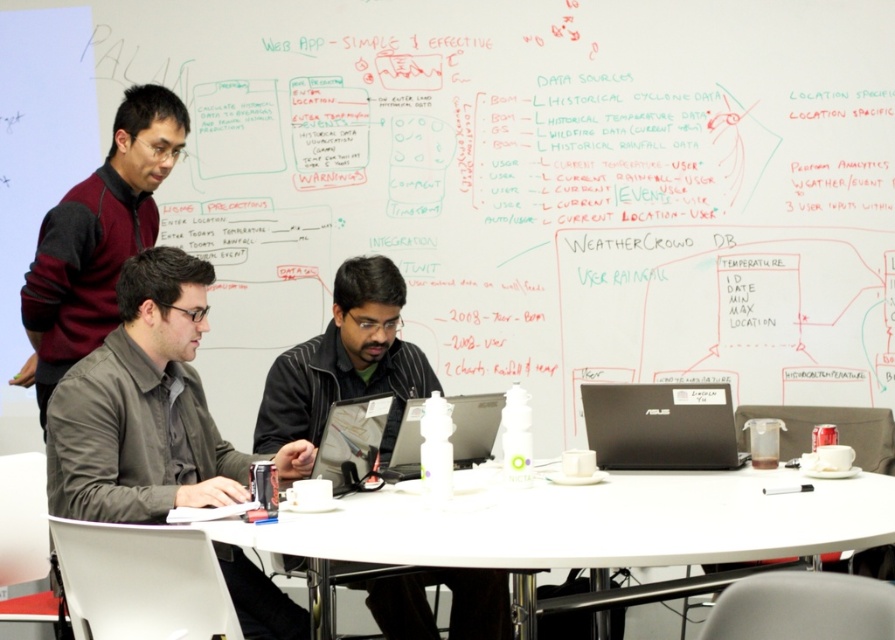
Which is below, whiteboard at upper center or dark gray shirt at center?

dark gray shirt at center

Consider the image. Does whiteboard at upper center appear on the left side of dark gray shirt at center?

In fact, whiteboard at upper center is to the right of dark gray shirt at center.

Where is `whiteboard at upper center`? whiteboard at upper center is located at coordinates (538, 186).

Does dark gray shirt at center have a lesser height compared to black matte laptop at center?

Incorrect, dark gray shirt at center's height does not fall short of black matte laptop at center's.

Does point (182, 465) come closer to viewer compared to point (594, 392)?

Yes, it is in front of point (594, 392).

Is point (121, 516) farther from viewer compared to point (612, 404)?

That is False.

At what (x,y) coordinates should I click in order to perform the action: click on dark gray shirt at center. Please return your answer as a coordinate pair (x, y). Looking at the image, I should click on (142, 406).

Between point (381, 260) and point (602, 429), which one is positioned behind?

Positioned behind is point (381, 260).

Does black matte shirt at center have a lesser width compared to black matte laptop at center?

No.

At what (x,y) coordinates should I click in order to perform the action: click on black matte shirt at center. Please return your answer as a coordinate pair (x, y). This screenshot has width=895, height=640. Looking at the image, I should click on (346, 362).